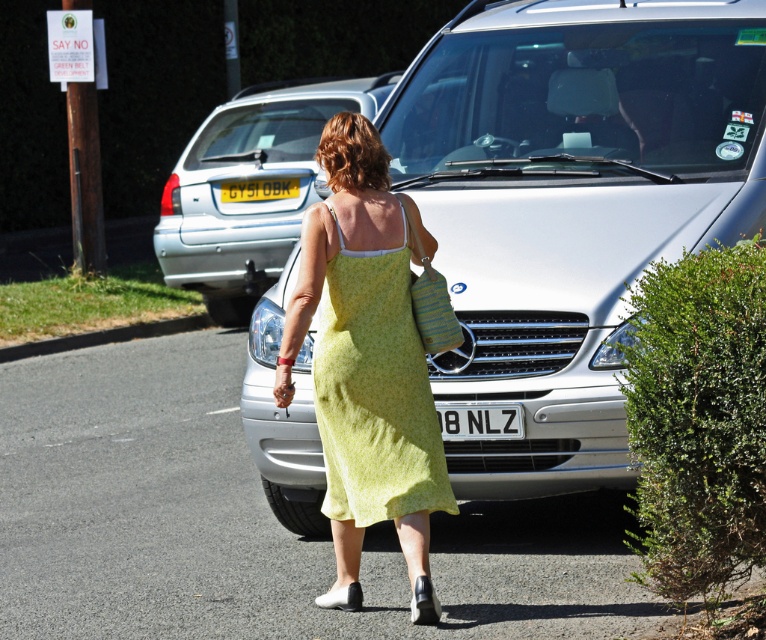
Looking at this image, what are the coordinates of the white plastic license plate at center?

The white plastic license plate at center is located at coordinates point (480, 420).

In the scene shown: You are a traffic officer who needs to verify license plate visibility for a parking permit. You see two license plates in the image, a white plastic license plate at center and a yellow plastic license plate at center. Which license plate is smaller in size?

The white plastic license plate at center is smaller in size than the yellow plastic license plate at center because it occupies less space.

You are standing at the camera position and want to take a photo of the silver metallic car at center. The camera has a maximum focus range of 25 feet. Will the car be in focus?

The silver metallic car at center is 26.49 feet away from camera, which exceeds the camera maximum focus range of 25 feet. Therefore, the car will not be in focus.